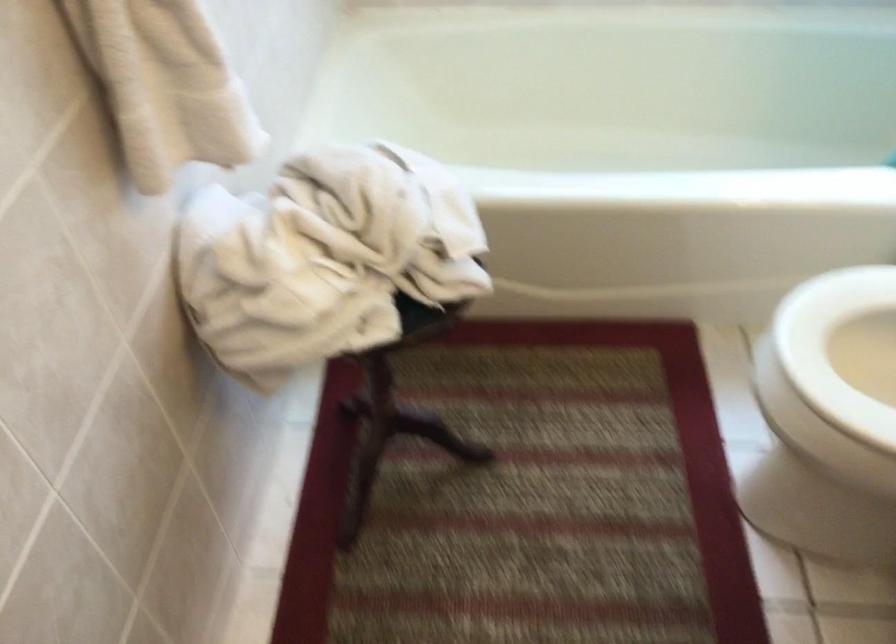
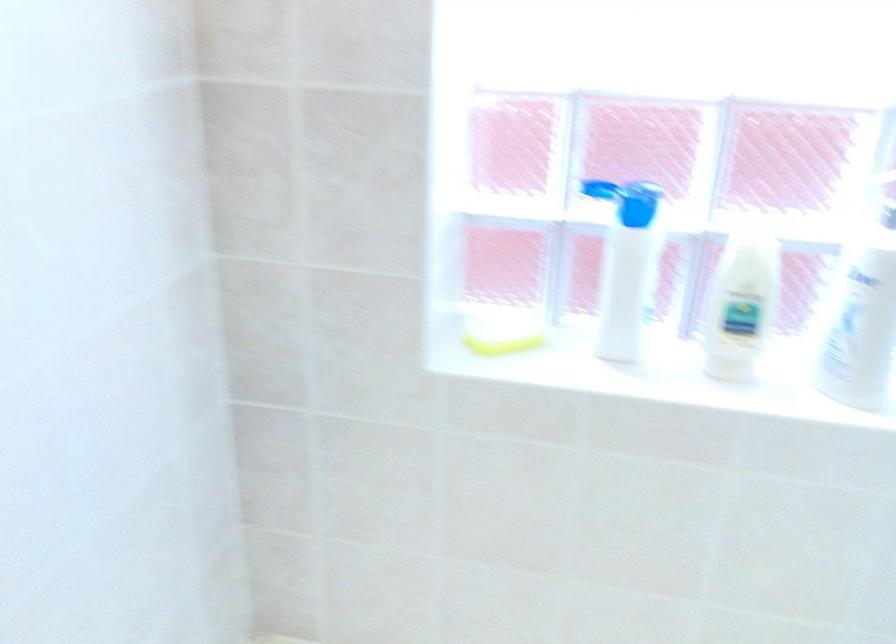
Question: How did the camera likely rotate?

Choices:
 (A) Left
 (B) Right
 (C) Up
 (D) Down

Answer: (C)